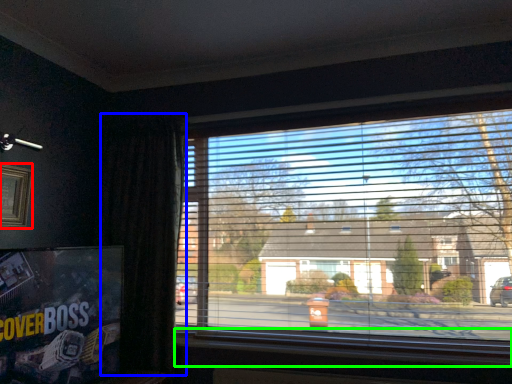
Question: Which is farther away from picture frame (highlighted by a red box)? curtain (highlighted by a blue box) or window sill (highlighted by a green box)?

Choices:
 (A) curtain
 (B) window sill

Answer: (B)